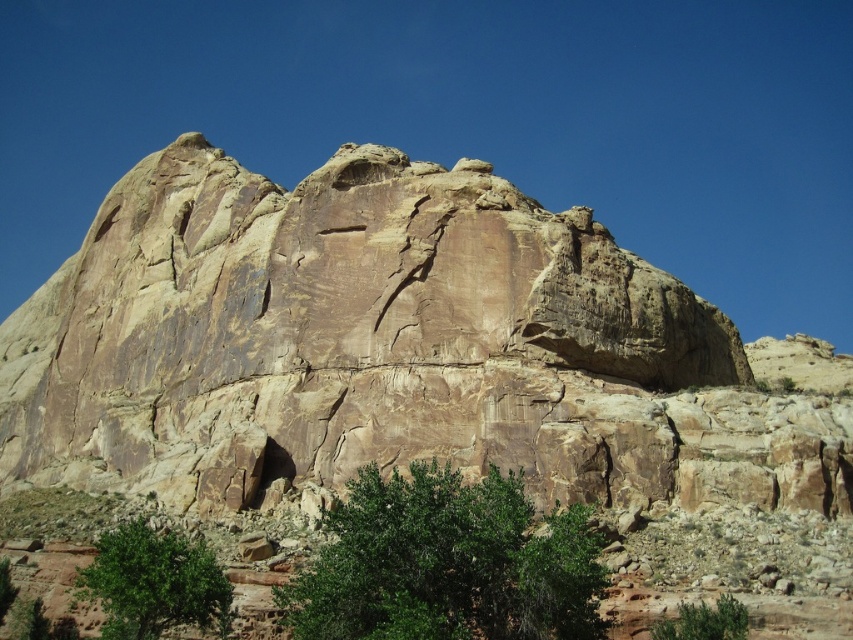
You are standing in front of the rock formation and want to place a picnic blanket between the green leafy tree at center and the green leafy bush at lower center. Based on their sizes, which object should you position closer to accommodate the blanket?

The green leafy bush at lower center is narrower than the green leafy tree at center, so you should position the picnic blanket closer to the green leafy bush at lower center to ensure there is enough space.

You are standing in front of the rock formation and want to determine which of the two points, point (102, 602) or point (688, 618), is nearer to you. Based on the scene description, which point is closer?

Point (102, 602) is closer to the viewer than point (688, 618).